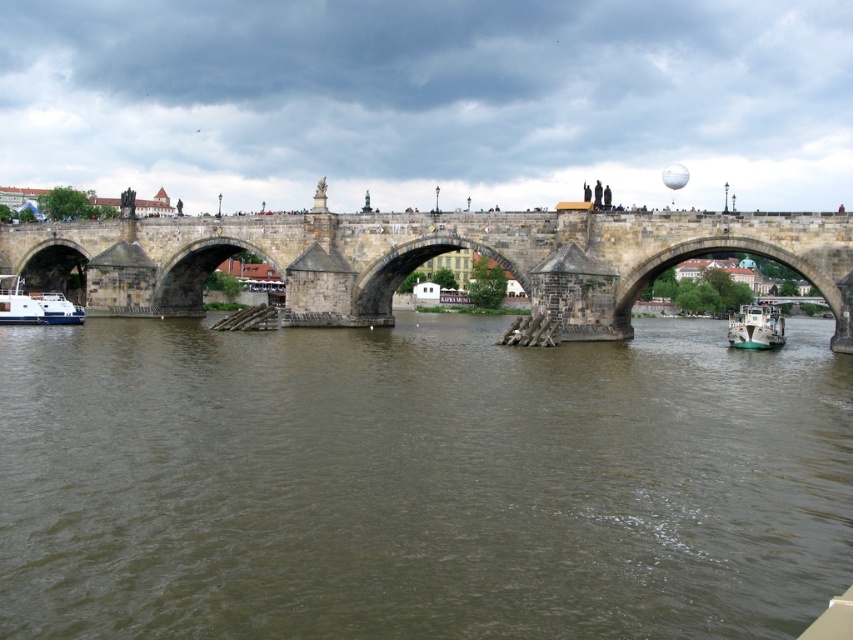
Can you confirm if stone bridge at center is thinner than white glossy boat at lower left?

Incorrect, stone bridge at center's width is not less than white glossy boat at lower left's.

Consider the image. Between stone bridge at center and white glossy boat at lower left, which one has less height?

white glossy boat at lower left

Between point (662, 259) and point (15, 308), which one is positioned behind?

Point (15, 308)

Where is `stone bridge at center`? The image size is (853, 640). stone bridge at center is located at coordinates (424, 259).

Who is positioned more to the left, brown murky water at center or white glossy boat at lower left?

From the viewer's perspective, white glossy boat at lower left appears more on the left side.

Who is lower down, brown murky water at center or white glossy boat at lower left?

brown murky water at center is below.

The height and width of the screenshot is (640, 853). I want to click on brown murky water at center, so tap(419, 481).

In the scene shown: Who is lower down, stone bridge at center or white glossy boat at lower right?

white glossy boat at lower right is lower down.

Which of these two, stone bridge at center or white glossy boat at lower right, stands taller?

With more height is stone bridge at center.

The height and width of the screenshot is (640, 853). Describe the element at coordinates (424, 259) in the screenshot. I see `stone bridge at center` at that location.

Locate an element on the screen. This screenshot has width=853, height=640. stone bridge at center is located at coordinates (424, 259).